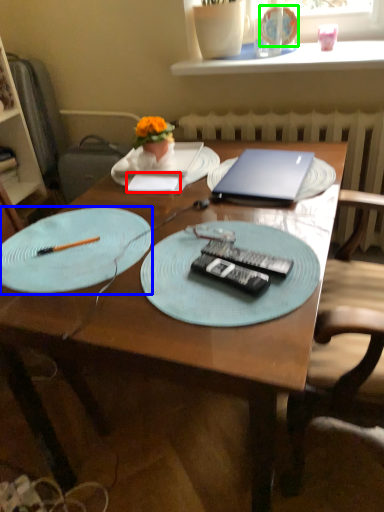
Question: Which object is the closest to the notepad (highlighted by a red box)? Choose among these: plate (highlighted by a blue box) or tableware (highlighted by a green box).

Choices:
 (A) plate
 (B) tableware

Answer: (A)